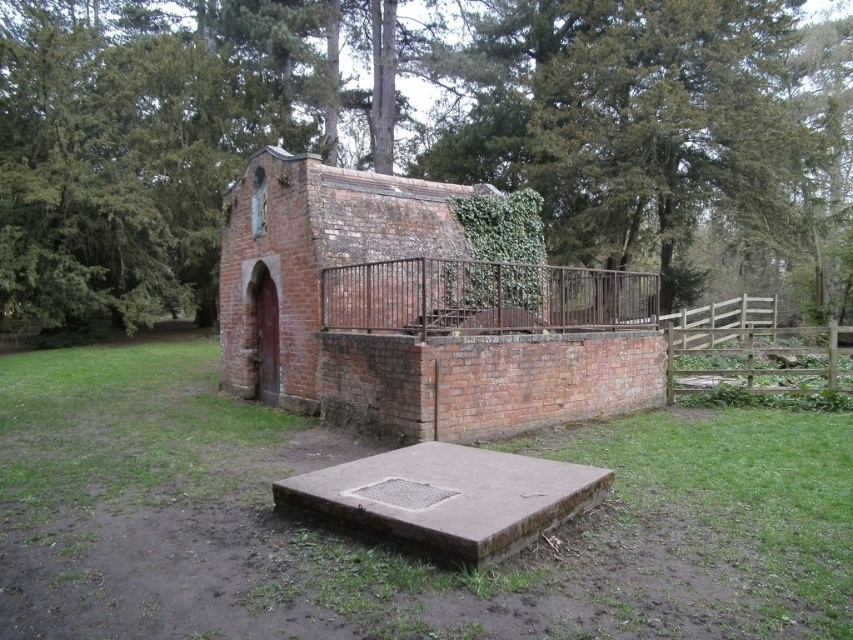
You are standing in front of the brick chapel at center and want to place a flowerpot on the ground near the rusty metal fence at center. Since the flowerpot is heavy, you need to know which object is lower to the ground to avoid lifting it too high. Which one is lower?

The rusty metal fence at center is lower to the ground than the brick chapel at center, so you should place the flowerpot near the rusty metal fence at center to avoid lifting it too high.

You are standing in the grassy area near the brick chapel at center and looking towards the green leafy tree at upper center. Which object is directly above the other?

The green leafy tree at upper center is positioned over the brick chapel at center, so the tree is directly above the chapel.